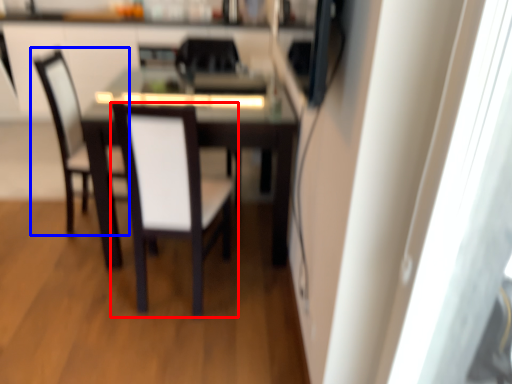
Question: Which of the following is the farthest to the observer, chair (highlighted by a red box) or chair (highlighted by a blue box)?

Choices:
 (A) chair
 (B) chair

Answer: (B)